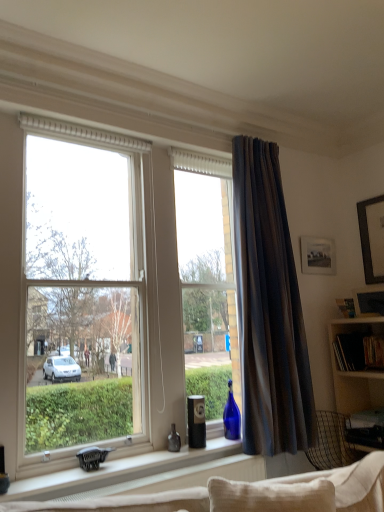
Question: Does dark grey textured curtain at right touch matte glass bottle at window sill?

Choices:
 (A) yes
 (B) no

Answer: (B)

Question: Could matte glass bottle at window sill be considered to be inside dark grey textured curtain at right?

Choices:
 (A) no
 (B) yes

Answer: (A)

Question: Is there a large distance between dark grey textured curtain at right and matte glass bottle at window sill?

Choices:
 (A) yes
 (B) no

Answer: (A)

Question: Considering the relative sizes of dark grey textured curtain at right and matte glass bottle at window sill in the image provided, is dark grey textured curtain at right wider than matte glass bottle at window sill?

Choices:
 (A) yes
 (B) no

Answer: (A)

Question: From a real-world perspective, is dark grey textured curtain at right under matte glass bottle at window sill?

Choices:
 (A) yes
 (B) no

Answer: (B)

Question: Is dark grey textured curtain at right further to the viewer compared to matte glass bottle at window sill?

Choices:
 (A) no
 (B) yes

Answer: (A)

Question: From a real-world perspective, is metallic silver desk at lower right physically above transparent glass window at center?

Choices:
 (A) no
 (B) yes

Answer: (A)

Question: From the image's perspective, is metallic silver desk at lower right located beneath transparent glass window at center?

Choices:
 (A) yes
 (B) no

Answer: (A)

Question: Is there a large distance between metallic silver desk at lower right and transparent glass window at center?

Choices:
 (A) yes
 (B) no

Answer: (A)

Question: Can you confirm if metallic silver desk at lower right is thinner than transparent glass window at center?

Choices:
 (A) no
 (B) yes

Answer: (A)

Question: Does metallic silver desk at lower right turn towards transparent glass window at center?

Choices:
 (A) no
 (B) yes

Answer: (A)

Question: Is metallic silver desk at lower right completely or partially outside of transparent glass window at center?

Choices:
 (A) yes
 (B) no

Answer: (A)

Question: Can you confirm if dark grey textured curtain at right is wider than white matte window sill at center?

Choices:
 (A) yes
 (B) no

Answer: (A)